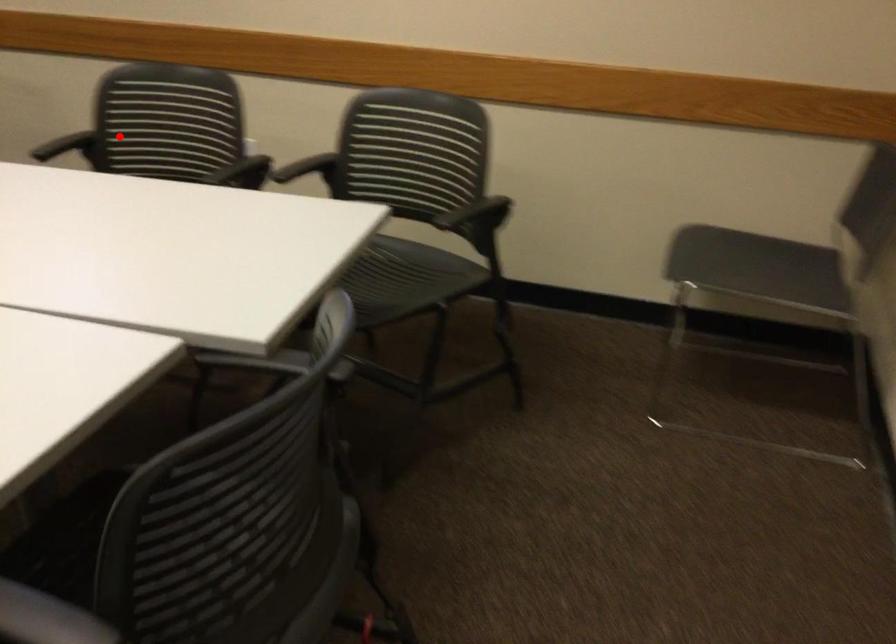
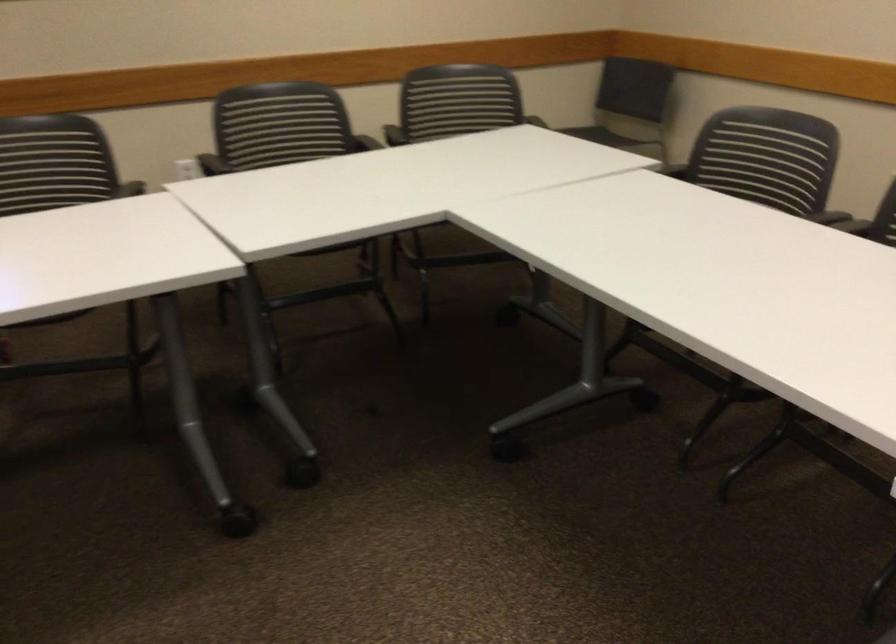
Question: I am providing you with two images of the same scene from different viewpoints. Image1 has a red point marked. In image2, the corresponding 3D location appears at what relative position? Reply with the corresponding letter.

Choices:
 (A) Closer
 (B) Farther

Answer: (B)